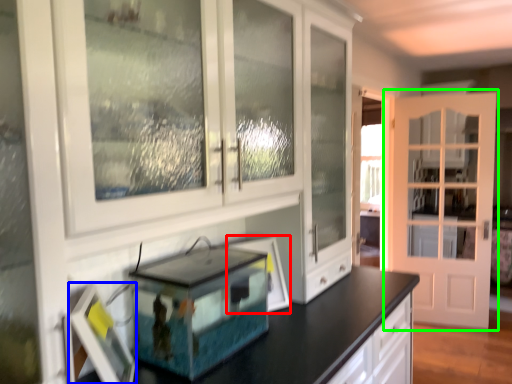
Question: Based on their relative distances, which object is nearer to picture frame (highlighted by a red box)? Choose from picture frame (highlighted by a blue box) and door (highlighted by a green box).

Choices:
 (A) picture frame
 (B) door

Answer: (A)